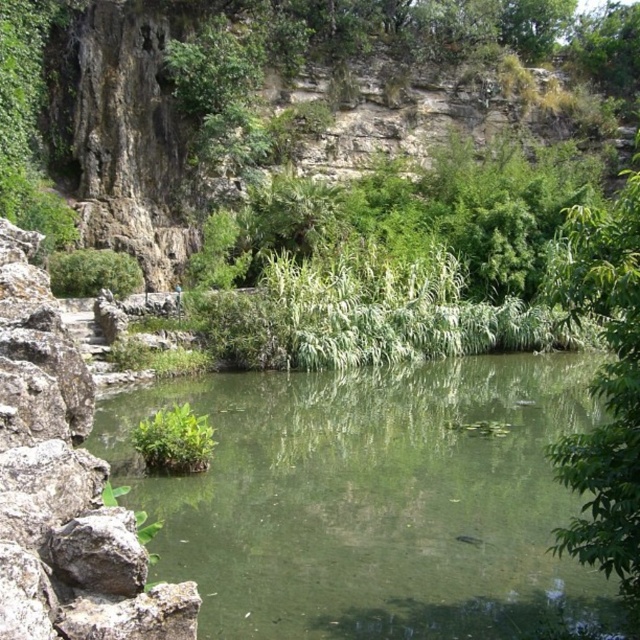
Can you confirm if green leafy tree at right is shorter than green leafy plant at center?

No.

What do you see at coordinates (605, 387) in the screenshot?
I see `green leafy tree at right` at bounding box center [605, 387].

Identify the location of green leafy tree at right. This screenshot has width=640, height=640. (605, 387).

Where is `green leafy tree at right`? green leafy tree at right is located at coordinates (605, 387).

From the picture: Does green translucent water at center appear on the right side of green leafy plant at center?

Yes, green translucent water at center is to the right of green leafy plant at center.

Does point (195, 518) come in front of point (161, 451)?

Yes, it is in front of point (161, 451).

This screenshot has height=640, width=640. Identify the location of green translucent water at center. (372, 499).

Does point (83, 529) come farther from viewer compared to point (628, 412)?

No, (83, 529) is in front of (628, 412).

Which of these two, gray rough rock at left or green leafy tree at right, stands shorter?

With less height is gray rough rock at left.

The image size is (640, 640). What do you see at coordinates (61, 484) in the screenshot?
I see `gray rough rock at left` at bounding box center [61, 484].

Where is `gray rough rock at left`? gray rough rock at left is located at coordinates (61, 484).